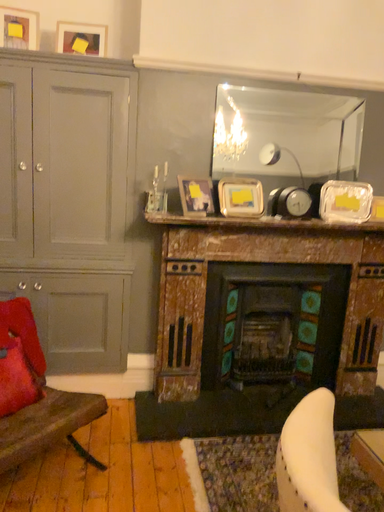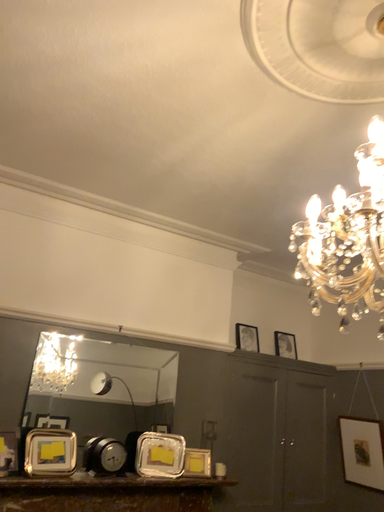
Question: Which way did the camera rotate in the video?

Choices:
 (A) rotated upward
 (B) rotated downward

Answer: (A)